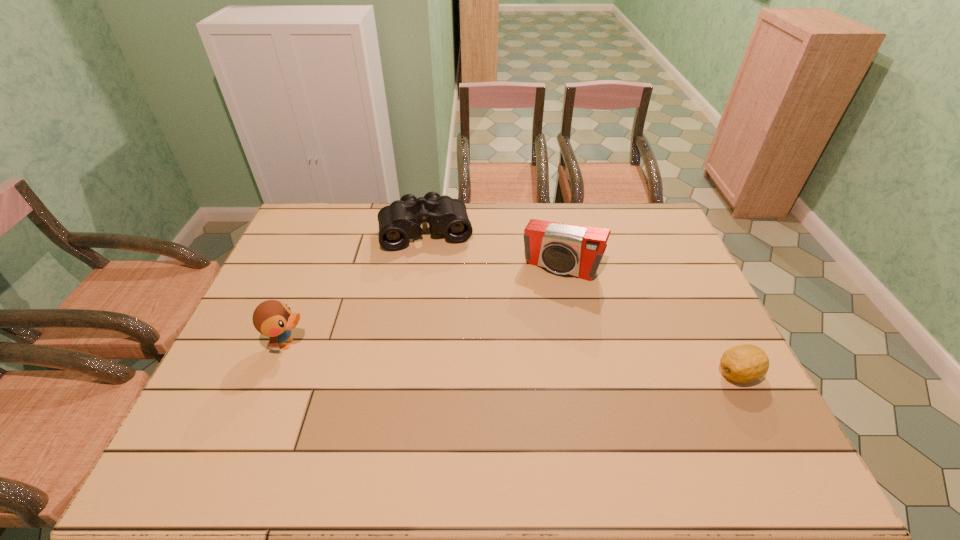
Find the location of a particular element. The height and width of the screenshot is (540, 960). free space on the desktop that is between the duck and the rightmost object and is positioned on the front-facing side of the second object from right to left is located at coordinates (517, 359).

The width and height of the screenshot is (960, 540). Find the location of `free spot on the desktop that is between the duck and the shortest object and is positioned at the eyepieces of the binoculars`. free spot on the desktop that is between the duck and the shortest object and is positioned at the eyepieces of the binoculars is located at coordinates (448, 354).